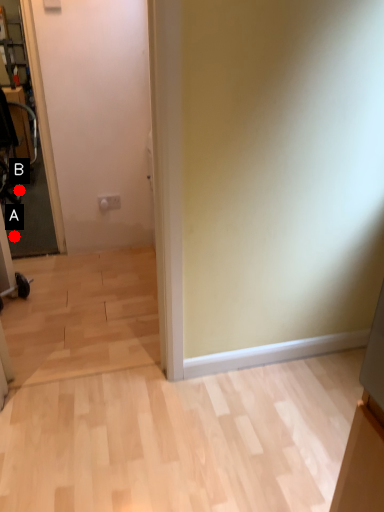
Question: Two points are circled on the image, labeled by A and B beside each circle. Among these points, which one is nearest to the camera?

Choices:
 (A) A is closer
 (B) B is closer

Answer: (A)